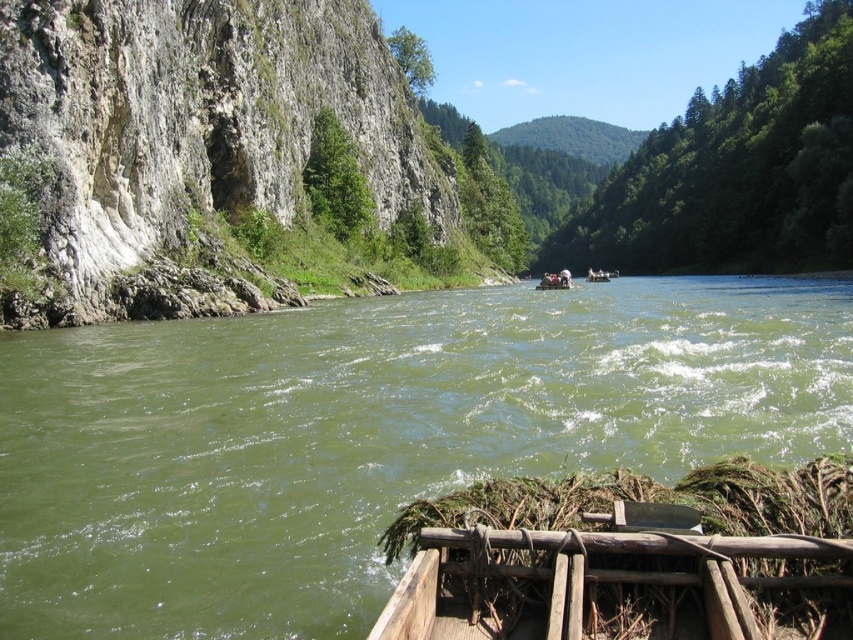
You are a hiker who wants to take a photo of the white rock cliff at left and the green leafy trees at upper center. Which object should you focus on first if you want to capture both in one frame without moving your camera?

The white rock cliff at left is below the green leafy trees at upper center, so you should focus on the green leafy trees at upper center first to ensure both are in the frame.

From the picture: You are standing on the wooden raft at center and looking towards the green leafy trees at upper center. Which object is closer to you?

The wooden raft at center is closer to you because you are standing on it, while the green leafy trees at upper center are further away from you.

Consider the image. You are navigating a small boat downstream on the river and need to know the exact location of the white rock cliff at left. What are its coordinates?

The white rock cliff at left is located at coordinates point (x=199, y=132).